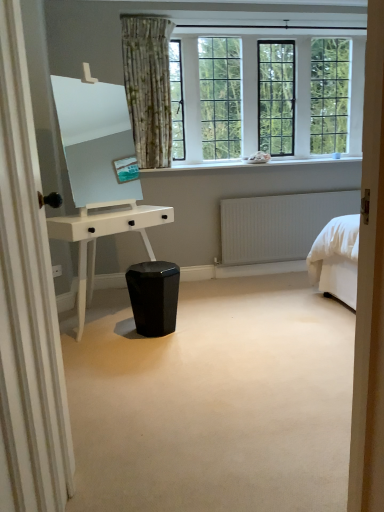
Question: Is clear glass windows at upper center turned away from white glossy desk at center?

Choices:
 (A) yes
 (B) no

Answer: (B)

Question: Is clear glass windows at upper center to the right of white glossy desk at center from the viewer's perspective?

Choices:
 (A) no
 (B) yes

Answer: (B)

Question: Is clear glass windows at upper center outside of white glossy desk at center?

Choices:
 (A) no
 (B) yes

Answer: (B)

Question: Can you confirm if clear glass windows at upper center is smaller than white glossy desk at center?

Choices:
 (A) no
 (B) yes

Answer: (B)

Question: Can you confirm if clear glass windows at upper center is shorter than white glossy desk at center?

Choices:
 (A) no
 (B) yes

Answer: (A)

Question: From a real-world perspective, is floral fabric curtain at upper left above or below white smooth window sill at upper center?

Choices:
 (A) above
 (B) below

Answer: (B)

Question: Is point (49, 388) positioned closer to the camera than point (238, 159)?

Choices:
 (A) closer
 (B) farther

Answer: (A)

Question: From the image's perspective, is floral fabric curtain at upper left above or below white smooth window sill at upper center?

Choices:
 (A) above
 (B) below

Answer: (B)

Question: Based on their positions, is floral fabric curtain at upper left located to the left or right of white smooth window sill at upper center?

Choices:
 (A) right
 (B) left

Answer: (B)

Question: Which is correct: glossy black stool at center is inside white glossy desk at center, or outside of it?

Choices:
 (A) outside
 (B) inside

Answer: (A)

Question: Considering the relative positions of glossy black stool at center and white glossy desk at center in the image provided, is glossy black stool at center to the left or to the right of white glossy desk at center?

Choices:
 (A) right
 (B) left

Answer: (A)

Question: Considering their positions, is glossy black stool at center located in front of or behind white glossy desk at center?

Choices:
 (A) front
 (B) behind

Answer: (A)

Question: From the image's perspective, relative to white glossy desk at center, is glossy black stool at center above or below?

Choices:
 (A) above
 (B) below

Answer: (B)

Question: From the image's perspective, is glossy black stool at center positioned above or below white smooth window sill at upper center?

Choices:
 (A) above
 (B) below

Answer: (B)

Question: Is glossy black stool at center situated inside white smooth window sill at upper center or outside?

Choices:
 (A) inside
 (B) outside

Answer: (B)